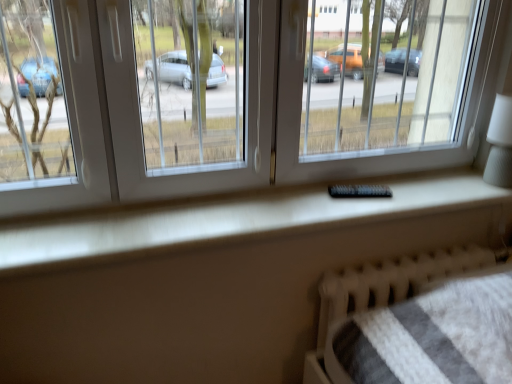
Question: From the image's perspective, is black plastic remote at center on top of white textured lampshade at right?

Choices:
 (A) no
 (B) yes

Answer: (A)

Question: Can you confirm if black plastic remote at center is positioned to the right of white textured lampshade at right?

Choices:
 (A) no
 (B) yes

Answer: (A)

Question: Is black plastic remote at center at the left side of white textured lampshade at right?

Choices:
 (A) no
 (B) yes

Answer: (B)

Question: Is black plastic remote at center shorter than white textured lampshade at right?

Choices:
 (A) yes
 (B) no

Answer: (A)

Question: Is black plastic remote at center closer to the viewer compared to white textured lampshade at right?

Choices:
 (A) yes
 (B) no

Answer: (B)

Question: Does black plastic remote at center have a lesser width compared to white textured lampshade at right?

Choices:
 (A) yes
 (B) no

Answer: (A)

Question: From the image's perspective, would you say white textured lampshade at right is positioned over black plastic remote at center?

Choices:
 (A) no
 (B) yes

Answer: (B)

Question: Is white textured lampshade at right positioned beyond the bounds of black plastic remote at center?

Choices:
 (A) yes
 (B) no

Answer: (A)

Question: Is white textured lampshade at right smaller than black plastic remote at center?

Choices:
 (A) no
 (B) yes

Answer: (A)

Question: Is white textured lampshade at right to the right of black plastic remote at center from the viewer's perspective?

Choices:
 (A) no
 (B) yes

Answer: (B)

Question: Considering the relative sizes of white textured lampshade at right and black plastic remote at center in the image provided, is white textured lampshade at right thinner than black plastic remote at center?

Choices:
 (A) no
 (B) yes

Answer: (A)

Question: Is the depth of white textured lampshade at right greater than that of black plastic remote at center?

Choices:
 (A) no
 (B) yes

Answer: (A)

Question: Considering the relative sizes of transparent plastic window at center and black plastic remote at center in the image provided, is transparent plastic window at center thinner than black plastic remote at center?

Choices:
 (A) yes
 (B) no

Answer: (B)